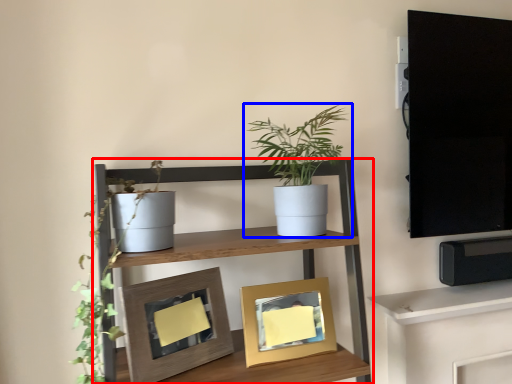
Question: Among these objects, which one is nearest to the camera, shelf (highlighted by a red box) or houseplant (highlighted by a blue box)?

Choices:
 (A) shelf
 (B) houseplant

Answer: (A)